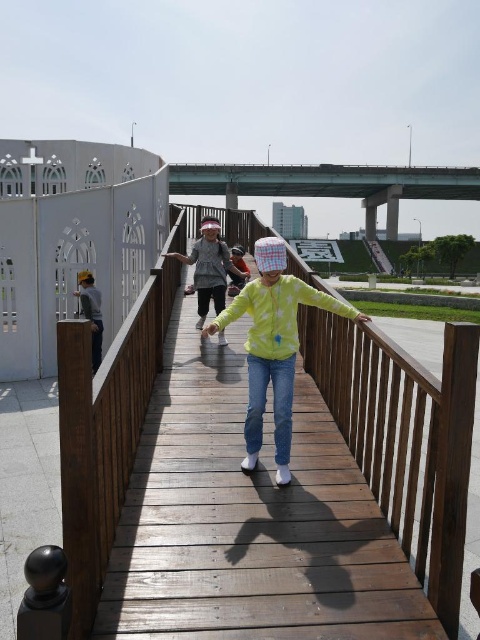
Is wooden rail at center to the left of light yellow fabric shirt at center from the viewer's perspective?

Incorrect, wooden rail at center is not on the left side of light yellow fabric shirt at center.

Who is more forward, (x=442, y=522) or (x=211, y=228)?

Point (x=442, y=522) is more forward.

Locate an element on the screen. The width and height of the screenshot is (480, 640). wooden rail at center is located at coordinates (404, 436).

Is the position of wooden rail at center more distant than that of dark gray jacket at left?

No.

Between wooden rail at center and dark gray jacket at left, which one is positioned higher?

wooden rail at center is above.

What are the coordinates of `wooden rail at center` in the screenshot? It's located at (404, 436).

Is wooden rail at center bigger than yellow matte jacket at center?

Correct, wooden rail at center is larger in size than yellow matte jacket at center.

Can you confirm if wooden rail at center is smaller than yellow matte jacket at center?

Actually, wooden rail at center might be larger than yellow matte jacket at center.

The height and width of the screenshot is (640, 480). In order to click on wooden rail at center in this screenshot , I will do `click(404, 436)`.